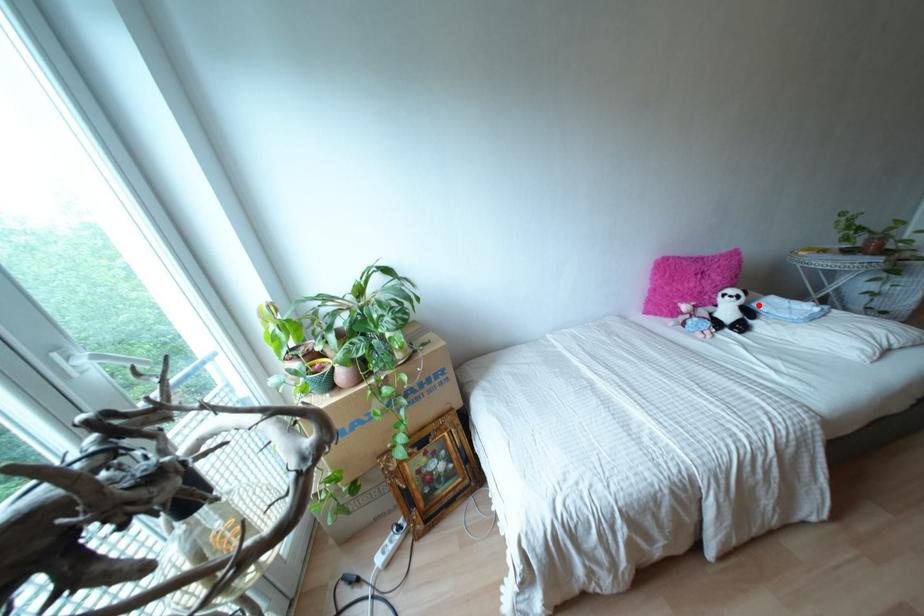
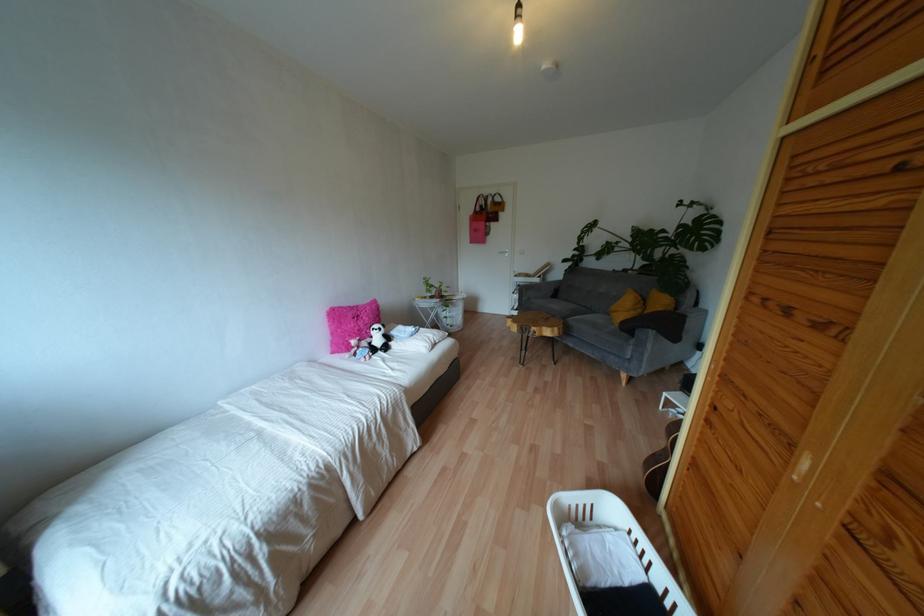
Locate, in the second image, the point that corresponds to the highlighted location in the first image.

(393, 331)